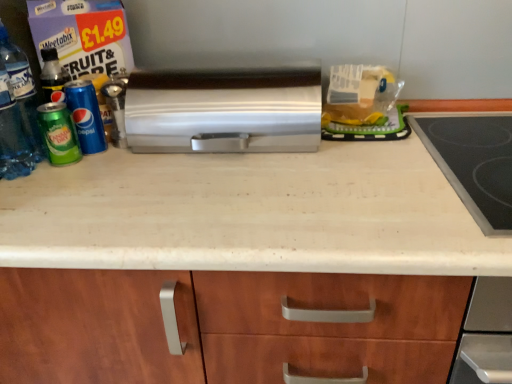
This screenshot has height=384, width=512. Find the location of `green matte can at left, positioned as the 1th beverage in right-to-left order`. green matte can at left, positioned as the 1th beverage in right-to-left order is located at coordinates (86, 115).

Describe the element at coordinates (238, 265) in the screenshot. I see `white laminate countertop at center` at that location.

The image size is (512, 384). In order to click on green matte can at left, which is the 2th beverage from right to left in this screenshot , I will do `click(58, 134)`.

The image size is (512, 384). Identify the location of green matte can at left, positioned as the 1th beverage in right-to-left order. (86, 115).

How different are the orientations of translucent plastic bottle at left and green matte can at left, positioned as the 1th beverage in right-to-left order, in degrees?

The angle between the facing direction of translucent plastic bottle at left and the facing direction of green matte can at left, positioned as the 1th beverage in right-to-left order, is 0.00479 degrees.

Can you confirm if translucent plastic bottle at left is positioned to the left of green matte can at left, the 2th beverage in the left-to-right sequence?

Correct, you'll find translucent plastic bottle at left to the left of green matte can at left, the 2th beverage in the left-to-right sequence.

Is translucent plastic bottle at left in front of or behind green matte can at left, the 2th beverage in the left-to-right sequence, in the image?

translucent plastic bottle at left is in front of green matte can at left, the 2th beverage in the left-to-right sequence.

From the image's perspective, is translucent plastic bottle at left on green matte can at left, the 2th beverage in the left-to-right sequence?

Yes, from the image's perspective, translucent plastic bottle at left is over green matte can at left, the 2th beverage in the left-to-right sequence.

Considering the relative sizes of black glass cooktop at right and satin silver toaster at center in the image provided, is black glass cooktop at right taller than satin silver toaster at center?

In fact, black glass cooktop at right may be shorter than satin silver toaster at center.

Locate an element on the screen. The image size is (512, 384). kitchen appliance that is above the black glass cooktop at right (from the image's perspective) is located at coordinates (224, 111).

Is satin silver toaster at center located within black glass cooktop at right?

No, black glass cooktop at right does not contain satin silver toaster at center.

Is black glass cooktop at right aimed at satin silver toaster at center?

No, black glass cooktop at right is not oriented towards satin silver toaster at center.

Considering the positions of objects black glass cooktop at right and green matte can at left, positioned as the 1th beverage in right-to-left order, in the image provided, who is behind, black glass cooktop at right or green matte can at left, positioned as the 1th beverage in right-to-left order,?

Positioned behind is green matte can at left, positioned as the 1th beverage in right-to-left order.

How far apart are black glass cooktop at right and green matte can at left, the 2th beverage in the left-to-right sequence?

A distance of 29.16 inches exists between black glass cooktop at right and green matte can at left, the 2th beverage in the left-to-right sequence.

Is black glass cooktop at right not near green matte can at left, the 2th beverage in the left-to-right sequence?

No.

Is black glass cooktop at right outside of green matte can at left, the 2th beverage in the left-to-right sequence?

black glass cooktop at right lies outside green matte can at left, the 2th beverage in the left-to-right sequence,'s area.

What's the angular difference between white laminate countertop at center and green matte can at left, the 1th beverage positioned from the left,'s facing directions?

0.357 degrees separate the facing orientations of white laminate countertop at center and green matte can at left, the 1th beverage positioned from the left.

From a real-world perspective, which is physically above, white laminate countertop at center or green matte can at left, the 1th beverage positioned from the left?

From a 3D spatial view, green matte can at left, the 1th beverage positioned from the left, is above.

Is white laminate countertop at center directly adjacent to green matte can at left, the 1th beverage positioned from the left?

No, white laminate countertop at center is not beside green matte can at left, the 1th beverage positioned from the left.

In the image, is white laminate countertop at center positioned in front of or behind green matte can at left, the 1th beverage positioned from the left?

In the image, white laminate countertop at center appears in front of green matte can at left, the 1th beverage positioned from the left.

From the image's perspective, which is below, black glass cooktop at right or translucent plastic bag at upper center?

black glass cooktop at right is shown below in the image.

Is black glass cooktop at right inside or outside of translucent plastic bag at upper center?

black glass cooktop at right cannot be found inside translucent plastic bag at upper center.

Who is taller, black glass cooktop at right or translucent plastic bag at upper center?

Standing taller between the two is translucent plastic bag at upper center.

Who is shorter, translucent plastic bottle at left or white laminate countertop at center?

translucent plastic bottle at left is shorter.

From the image's perspective, is translucent plastic bottle at left over white laminate countertop at center?

Correct, translucent plastic bottle at left appears higher than white laminate countertop at center in the image.

Does point (18, 51) come behind point (52, 243)?

Yes, point (18, 51) is farther from viewer.

Is translucent plastic bottle at left with white laminate countertop at center?

No, translucent plastic bottle at left is not next to white laminate countertop at center.

In the image, is translucent plastic bottle at left positioned in front of or behind satin silver toaster at center?

translucent plastic bottle at left is positioned closer to the viewer than satin silver toaster at center.

From the image's perspective, between translucent plastic bottle at left and satin silver toaster at center, which one is located above?

satin silver toaster at center is shown above in the image.

Which is behind, point (3, 109) or point (156, 132)?

The point (156, 132) is farther from the camera.

From the picture: Is translucent plastic bottle at left to the right of satin silver toaster at center from the viewer's perspective?

No, translucent plastic bottle at left is not to the right of satin silver toaster at center.

There is a translucent plastic bottle at left. Where is `the 1st beverage below it (from a real-world perspective)`? the 1st beverage below it (from a real-world perspective) is located at coordinates (86, 115).

Identify the location of gas stove located below the satin silver toaster at center (from the image's perspective). (474, 164).

Estimate the real-world distances between objects in this image. Which object is further from green matte can at left, positioned as the 1th beverage in right-to-left order, translucent plastic bag at upper center or white laminate countertop at center?

translucent plastic bag at upper center lies further to green matte can at left, positioned as the 1th beverage in right-to-left order, than the other object.

Based on their spatial positions, is translucent plastic bottle at left or satin silver toaster at center further from white laminate countertop at center?

translucent plastic bottle at left is further to white laminate countertop at center.

Looking at this image, looking at the image, which one is located closer to white laminate countertop at center, translucent plastic bottle at left or translucent plastic bag at upper center?

The object closer to white laminate countertop at center is translucent plastic bag at upper center.

Which object lies further to the anchor point black glass cooktop at right, translucent plastic bag at upper center or green matte can at left, which is the 2th beverage from right to left?

green matte can at left, which is the 2th beverage from right to left, lies further to black glass cooktop at right than the other object.

Based on their spatial positions, is green matte can at left, positioned as the 1th beverage in right-to-left order, or translucent plastic bag at upper center closer to green matte can at left, the 1th beverage positioned from the left?

The object closer to green matte can at left, the 1th beverage positioned from the left, is green matte can at left, positioned as the 1th beverage in right-to-left order.

When comparing their distances from white laminate countertop at center, does green matte can at left, the 2th beverage in the left-to-right sequence, or black glass cooktop at right seem further?

green matte can at left, the 2th beverage in the left-to-right sequence, is further to white laminate countertop at center.

From the image, which object appears to be nearer to green matte can at left, positioned as the 1th beverage in right-to-left order, satin silver toaster at center or translucent plastic bottle at left?

translucent plastic bottle at left.

From the picture: From the image, which object appears to be farther from satin silver toaster at center, black glass cooktop at right or green matte can at left, positioned as the 1th beverage in right-to-left order?

black glass cooktop at right.

This screenshot has width=512, height=384. What are the coordinates of `kitchen appliance located between green matte can at left, the 1th beverage positioned from the left, and black glass cooktop at right in the left-right direction` in the screenshot? It's located at (224, 111).

The width and height of the screenshot is (512, 384). What are the coordinates of `food located between green matte can at left, the 1th beverage positioned from the left, and black glass cooktop at right in the left-right direction` in the screenshot? It's located at (359, 95).

The image size is (512, 384). What are the coordinates of `kitchen appliance located between translucent plastic bottle at left and black glass cooktop at right in the left-right direction` in the screenshot? It's located at (224, 111).

This screenshot has height=384, width=512. I want to click on countertop between green matte can at left, the 2th beverage in the left-to-right sequence, and black glass cooktop at right, so click(x=238, y=265).